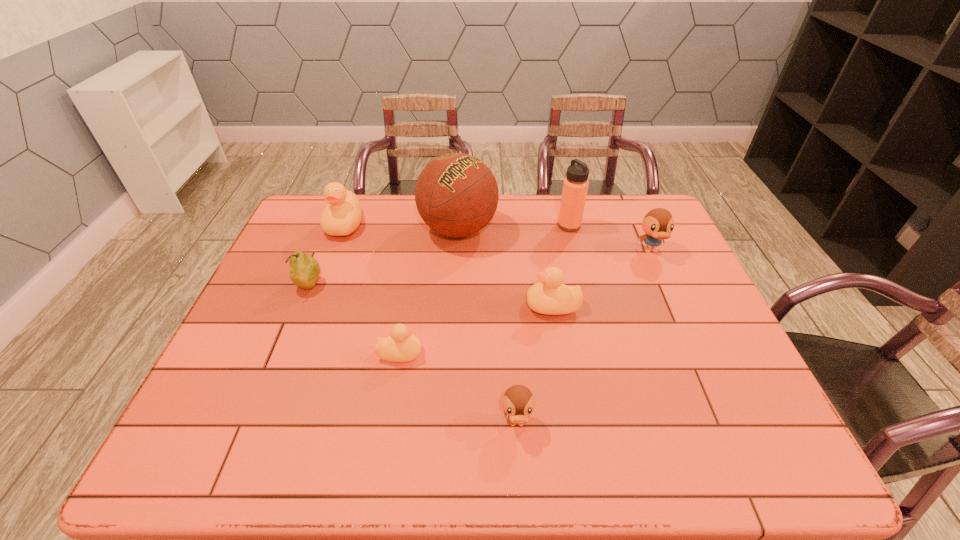
The image size is (960, 540). I want to click on object at the far left corner, so click(x=342, y=216).

Locate an element on the screen. Image resolution: width=960 pixels, height=540 pixels. free space at the far edge is located at coordinates (361, 203).

In order to click on free space at the near edge in this screenshot , I will do `click(444, 456)`.

Identify the location of vacant area at the left edge of the desktop. (216, 377).

At what (x,y) coordinates should I click in order to perform the action: click on vacant region at the right edge. Please return your answer as a coordinate pair (x, y). The width and height of the screenshot is (960, 540). Looking at the image, I should click on (732, 427).

I want to click on vacant space at the near left corner, so click(180, 435).

This screenshot has height=540, width=960. I want to click on free space between the pear and the seventh farthest object, so click(354, 319).

The image size is (960, 540). Identify the location of free space between the rightmost yellow duck and the basketball. (506, 267).

Where is `free area in between the second yellow duck from right to left and the farther blue duck`? This screenshot has width=960, height=540. free area in between the second yellow duck from right to left and the farther blue duck is located at coordinates (525, 302).

The height and width of the screenshot is (540, 960). What are the coordinates of `free point between the pear and the basketball` in the screenshot? It's located at (384, 257).